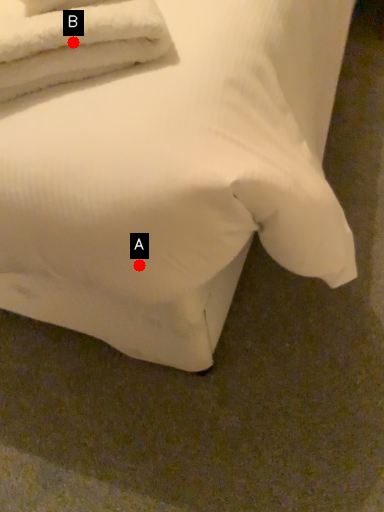
Question: Two points are circled on the image, labeled by A and B beside each circle. Which point is farther from the camera taking this photo?

Choices:
 (A) A is further
 (B) B is further

Answer: (A)